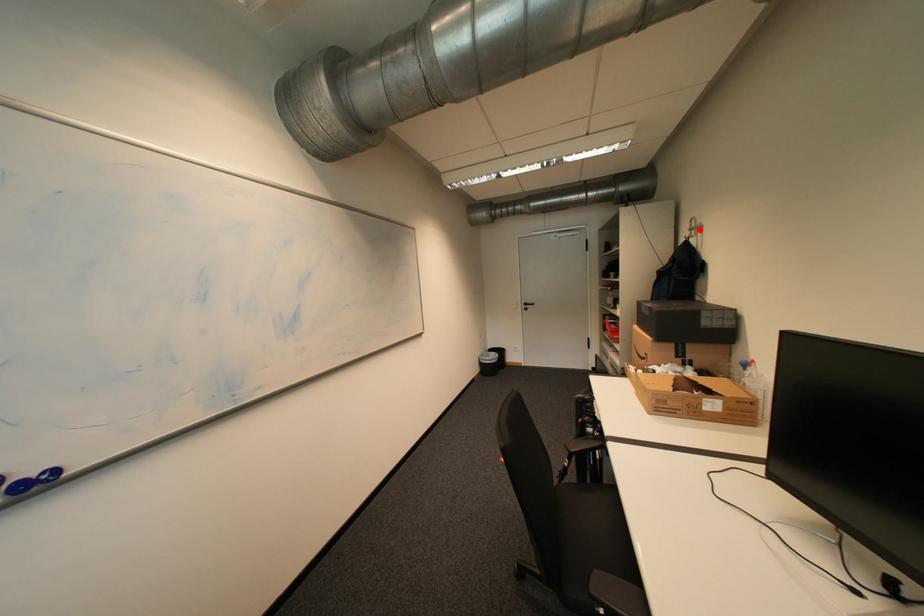
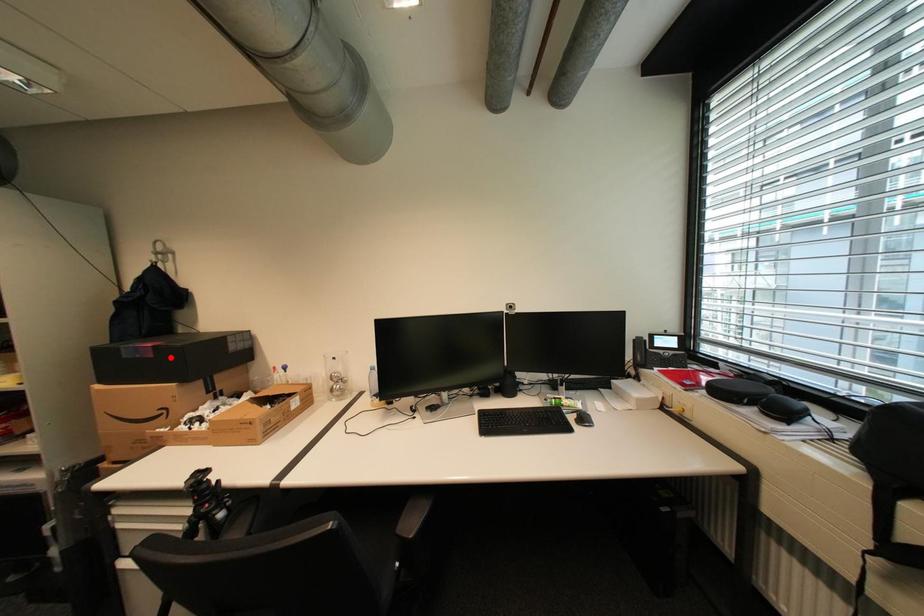
I am providing you with two images of the same scene from different viewpoints. A red point is marked on the first image and another point is marked on the second image. Is the red point in image1 aligned with the point shown in image2?

No